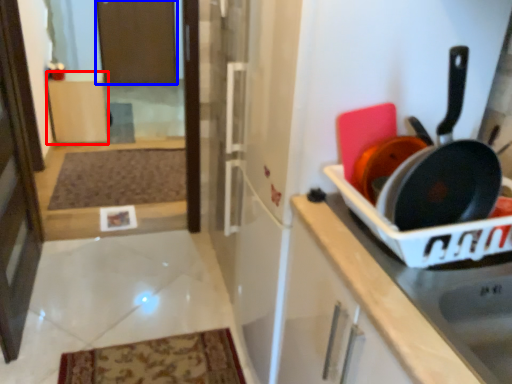
Question: Which point is closer to the camera, cabinetry (highlighted by a red box) or screen door (highlighted by a blue box)?

Choices:
 (A) cabinetry
 (B) screen door

Answer: (A)